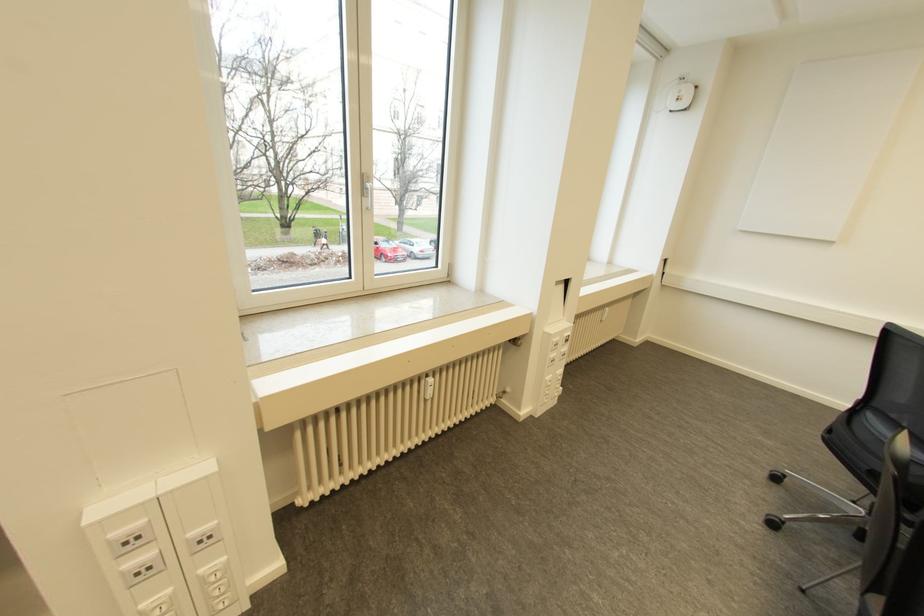
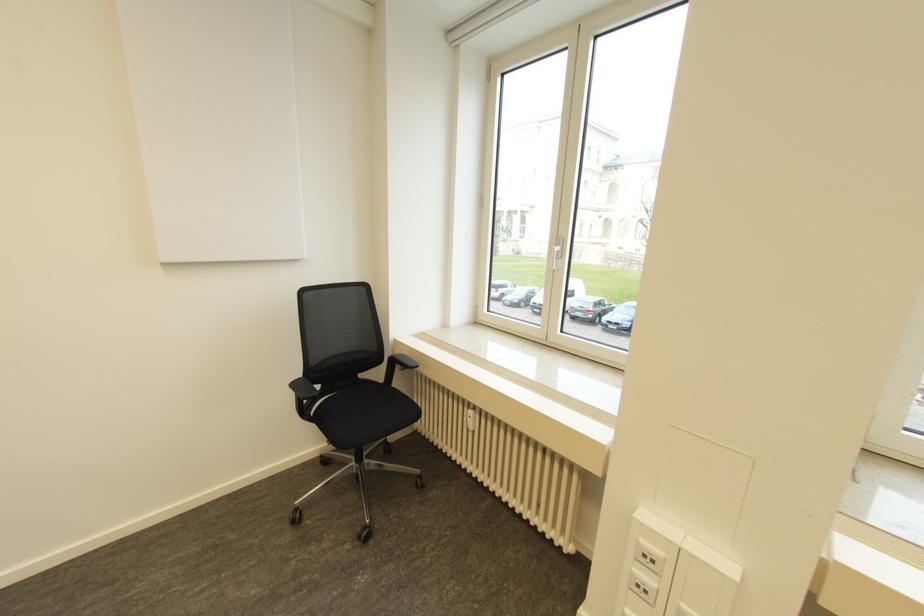
Question: Based on the continuous images, in which direction is the camera rotating? Reply with the corresponding letter.

Choices:
 (A) Left
 (B) Right
 (C) Up
 (D) Down

Answer: (A)